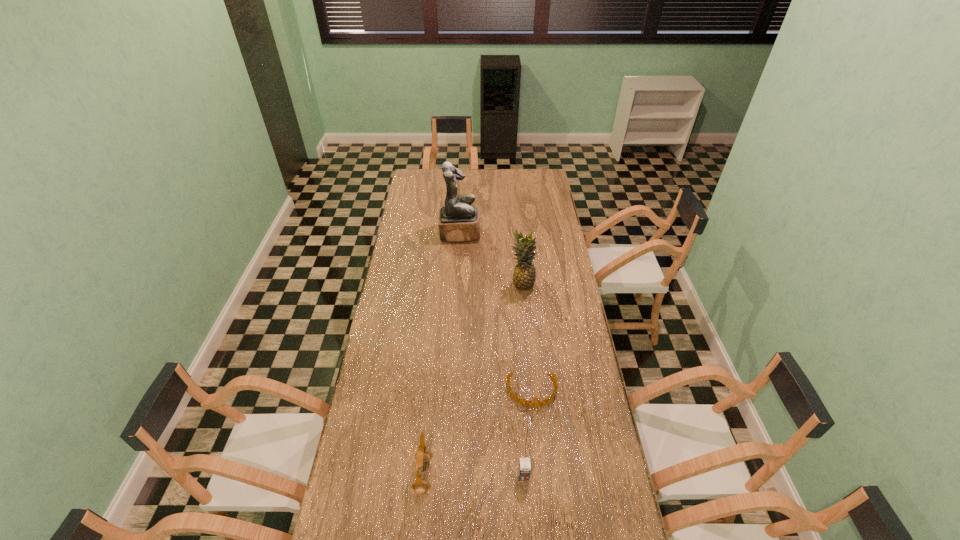
Where is `free space located on the front-facing side of the earphone`? Image resolution: width=960 pixels, height=540 pixels. free space located on the front-facing side of the earphone is located at coordinates click(495, 475).

The width and height of the screenshot is (960, 540). I want to click on vacant space located 0.160m on the front label of the fourth tallest object, so click(528, 535).

Find the location of a particular element. The height and width of the screenshot is (540, 960). vacant space located on the front-facing side of the shortest object is located at coordinates (536, 422).

The width and height of the screenshot is (960, 540). In order to click on object located at the right edge in this screenshot , I will do `click(547, 400)`.

Locate an element on the screen. The width and height of the screenshot is (960, 540). free region at the far edge of the desktop is located at coordinates (506, 180).

Find the location of `free region at the left edge of the desktop`. free region at the left edge of the desktop is located at coordinates (409, 273).

Where is `free region at the right edge`? The image size is (960, 540). free region at the right edge is located at coordinates (551, 191).

Locate an element on the screen. The width and height of the screenshot is (960, 540). vacant area at the far right corner is located at coordinates (540, 175).

Where is `vacant point located between the shortest object and the chocolate milk`? vacant point located between the shortest object and the chocolate milk is located at coordinates (528, 433).

At what (x,y) coordinates should I click in order to perform the action: click on free space that is in between the pineapple and the third tallest object. Please return your answer as a coordinate pair (x, y). This screenshot has height=540, width=960. Looking at the image, I should click on (472, 380).